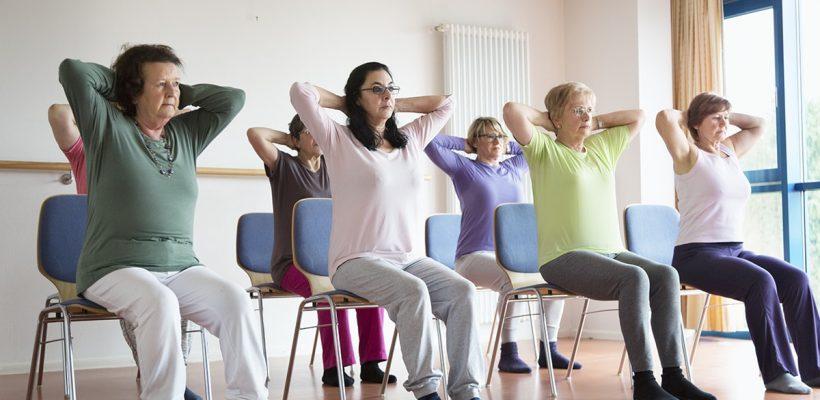
Find the location of a particular element. visible chairs is located at coordinates (57, 235), (247, 230), (303, 238), (442, 241), (530, 234), (638, 231).